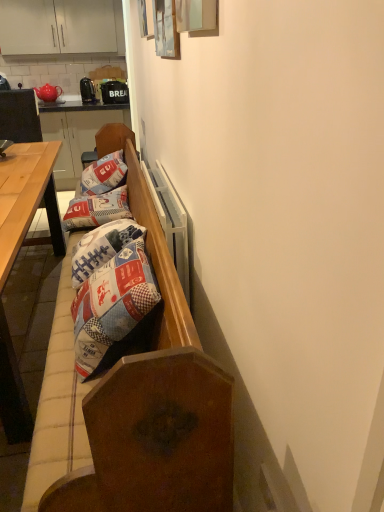
Question: Is light brown wooden table at left thinner than matte ceramic teapot at upper left?

Choices:
 (A) no
 (B) yes

Answer: (A)

Question: Considering the relative sizes of light brown wooden table at left and matte ceramic teapot at upper left in the image provided, is light brown wooden table at left smaller than matte ceramic teapot at upper left?

Choices:
 (A) yes
 (B) no

Answer: (B)

Question: Is light brown wooden table at left oriented towards matte ceramic teapot at upper left?

Choices:
 (A) yes
 (B) no

Answer: (B)

Question: Is light brown wooden table at left to the right of matte ceramic teapot at upper left from the viewer's perspective?

Choices:
 (A) yes
 (B) no

Answer: (A)

Question: Is light brown wooden table at left looking in the opposite direction of matte ceramic teapot at upper left?

Choices:
 (A) yes
 (B) no

Answer: (A)

Question: Is light brown wooden table at left shorter than matte ceramic teapot at upper left?

Choices:
 (A) yes
 (B) no

Answer: (B)

Question: Is white matte cabinet at upper left not inside matte ceramic teapot at upper left?

Choices:
 (A) yes
 (B) no

Answer: (A)

Question: Is white matte cabinet at upper left smaller than matte ceramic teapot at upper left?

Choices:
 (A) no
 (B) yes

Answer: (A)

Question: Can you confirm if white matte cabinet at upper left is wider than matte ceramic teapot at upper left?

Choices:
 (A) no
 (B) yes

Answer: (B)

Question: Does white matte cabinet at upper left turn towards matte ceramic teapot at upper left?

Choices:
 (A) yes
 (B) no

Answer: (B)

Question: From the image's perspective, is white matte cabinet at upper left below matte ceramic teapot at upper left?

Choices:
 (A) no
 (B) yes

Answer: (A)

Question: Is white matte cabinet at upper left at the right side of matte ceramic teapot at upper left?

Choices:
 (A) yes
 (B) no

Answer: (A)

Question: Is light brown wooden table at left oriented towards patchwork fabric pillow at center, the 2th pillow viewed from the front?

Choices:
 (A) yes
 (B) no

Answer: (B)